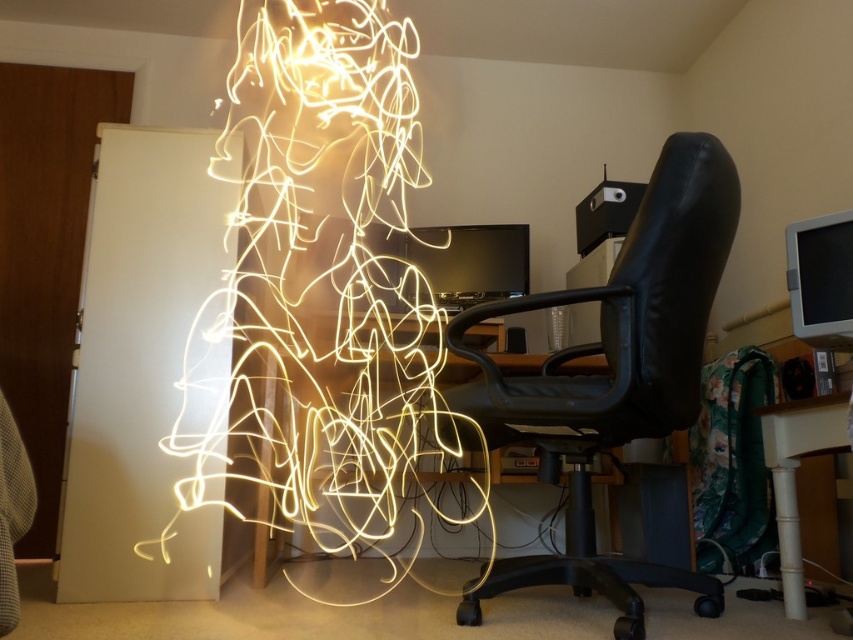
You are standing in the home office and want to place a small plant between the two points, point (608,428) and point (788,529). Which point should the plant be closer to if you want it to be more visible from your current position?

The plant should be placed closer to point (608,428) because it is closer to the camera than point (788,529), making it more visible from your current position.

You are sitting in the black leather swivel chair at center and want to reach the white glossy table at lower right. Which direction should you turn to face the table?

Since the white glossy table at lower right is positioned to your right side, you should turn to your right to face it.